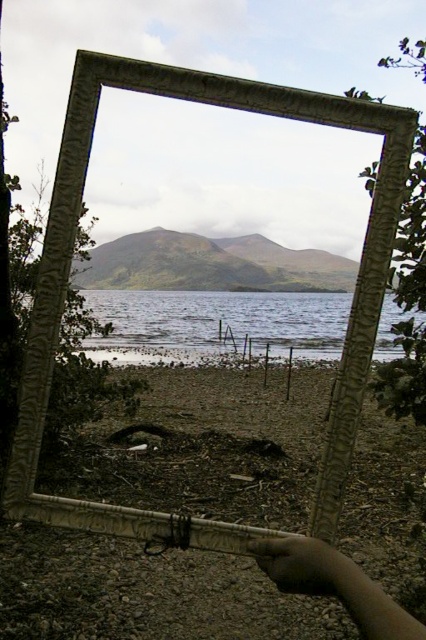
You are an artist holding a large ornate picture frame. You notice the clear water at center and the dark skin hand at lower right. Which object in your view is bigger?

The clear water at center is larger in size than the dark skin hand at lower right.

You are holding the frame with your hand and looking through it. Which object is closer to the right edge of the frame? The clear water at center or the dark skin hand at lower right?

The clear water at center is to the right of the dark skin hand at lower right, so the clear water at center is closer to the right edge of the frame.

You are an artist trying to paint the scene through the ornate picture frame. Where should you focus your brushstrokes to accurately depict the clear water at center?

The clear water at center is located at the coordinates point (216, 323), so you should focus your brushstrokes at that central point to accurately depict it.